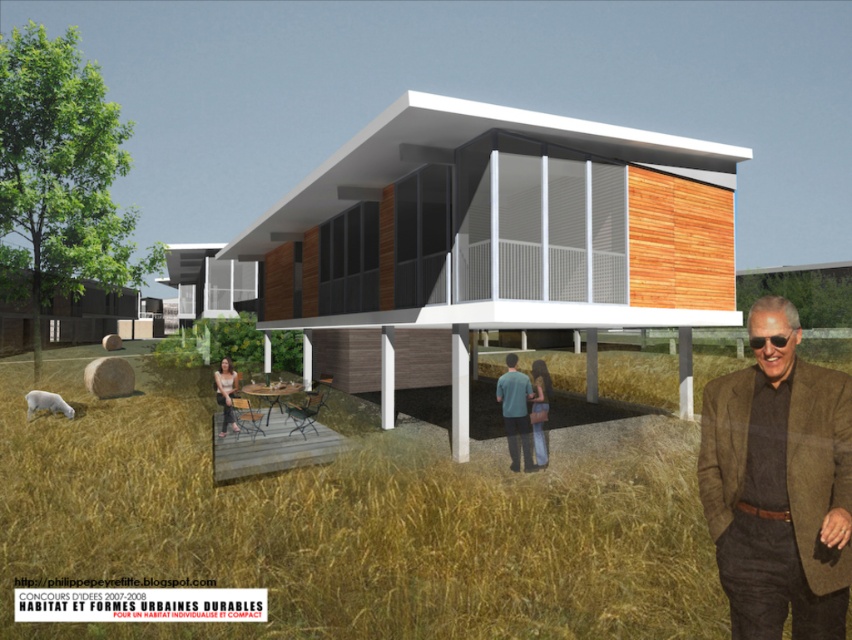
You are a photographer positioned at the entrance of the house. You notice a person wearing a teal fabric shirt at center and has matte brown hair at lower center. Which part of their clothing or body is shorter?

The teal fabric shirt at center is shorter than the matte brown hair at lower center.

You are a guest at this modern house and need to choose between placing your belongings on the brown wool jacket at lower right or the blue jeans at lower center. Based on their sizes, which one can hold larger items?

The brown wool jacket at lower right is much taller than the blue jeans at lower center, so it can hold larger items.

You are a visitor approaching the house and notice a person standing at lower center. Which object, the blue jeans at lower center or the matte brown hair at lower center, is closer to the ground?

The blue jeans at lower center is below matte brown hair at lower center, so it is closer to the ground.